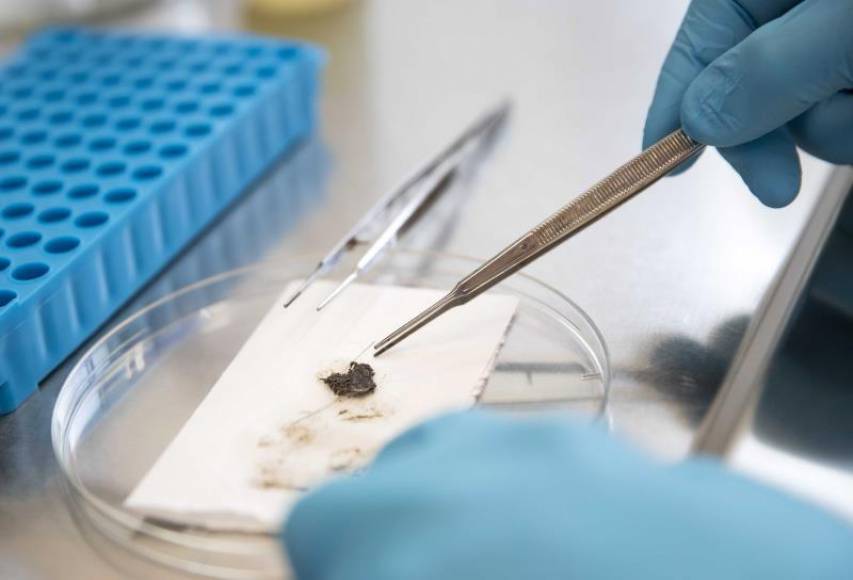
The width and height of the screenshot is (853, 580). Identify the location of napkin. (228, 409).